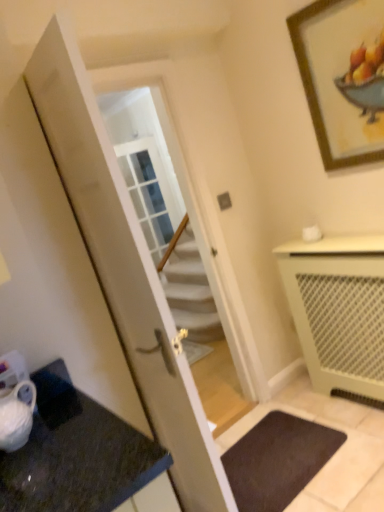
The width and height of the screenshot is (384, 512). What are the coordinates of `vacant location below dark brown carpet at lower center (from a real-world perspective)` in the screenshot? It's located at (268, 457).